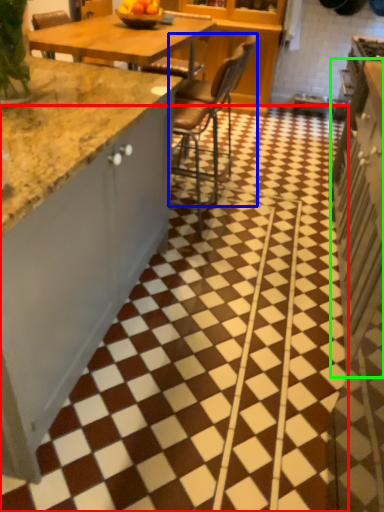
Question: Which object is positioned closest to tile (highlighted by a red box)? Select from chair (highlighted by a blue box) and cabinetry (highlighted by a green box).

Choices:
 (A) chair
 (B) cabinetry

Answer: (B)